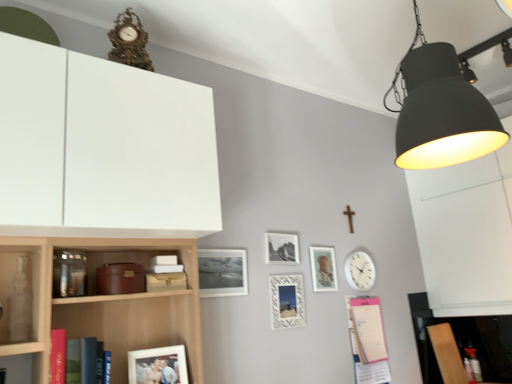
Image resolution: width=512 pixels, height=384 pixels. What are the coordinates of `matte silver picture frame at center-right, which is the first picture frame in back-to-front order` in the screenshot? It's located at (323, 269).

The image size is (512, 384). What do you see at coordinates (158, 365) in the screenshot?
I see `white matte picture frame at lower center, the fifth picture frame viewed from the back` at bounding box center [158, 365].

What is the approximate width of gold ornate clock at upper center, which is the first clock from left to right?

gold ornate clock at upper center, which is the first clock from left to right, is 6.44 inches in width.

Where is `matte black picture frame at upper center, placed as the fourth picture frame when sorted from right to left`? The width and height of the screenshot is (512, 384). matte black picture frame at upper center, placed as the fourth picture frame when sorted from right to left is located at coordinates (222, 272).

Which is in front, point (280, 328) or point (154, 375)?

Point (154, 375)

Is white textured picture frame at center, arranged as the third picture frame when viewed from the front, not close to white matte picture frame at lower center, the fifth picture frame viewed from the back?

white textured picture frame at center, arranged as the third picture frame when viewed from the front, is near white matte picture frame at lower center, the fifth picture frame viewed from the back, not far away.

Identify the location of the 2nd picture frame in front of the white textured picture frame at center, the 4th picture frame positioned from the left. The height and width of the screenshot is (384, 512). coord(158,365).

Based on the photo, looking at the image, does white textured picture frame at center, the 4th picture frame positioned from the left, seem bigger or smaller compared to white matte picture frame at lower center, which is counted as the 5th picture frame, starting from the right?

In the image, white textured picture frame at center, the 4th picture frame positioned from the left, appears to be smaller than white matte picture frame at lower center, which is counted as the 5th picture frame, starting from the right.

Is hardcover book at left, the 2th book from the right, not near metallic silver frame at center, positioned as the fourth picture frame in front-to-back order?

Yes, hardcover book at left, the 2th book from the right, and metallic silver frame at center, positioned as the fourth picture frame in front-to-back order, are located far from each other.

Considering the positions of point (75, 381) and point (294, 253), is point (75, 381) closer or farther from the camera than point (294, 253)?

Point (75, 381).

Based on the photo, is hardcover book at left, the 2th book ordered from the bottom, shorter than metallic silver frame at center, the 3th picture frame when ordered from right to left?

In fact, hardcover book at left, the 2th book ordered from the bottom, may be taller than metallic silver frame at center, the 3th picture frame when ordered from right to left.

From a real-world perspective, starting from the gold ornate clock at upper center, which is the first clock from left to right, which picture frame is the 1st one below it? Please provide its 2D coordinates.

[(281, 248)]

Is metallic silver frame at center, placed as the second picture frame when sorted from back to front, positioned with its back to gold ornate clock at upper center, the second clock from the bottom?

No, metallic silver frame at center, placed as the second picture frame when sorted from back to front, is not facing the opposite direction of gold ornate clock at upper center, the second clock from the bottom.

Based on the photo, does metallic silver frame at center, the 3th picture frame when ordered from right to left, come behind gold ornate clock at upper center, placed as the second clock when sorted from back to front?

Yes, it is behind gold ornate clock at upper center, placed as the second clock when sorted from back to front.

From a real-world perspective, which object stands above the other?

gold ornate clock at upper center, placed as the second clock when sorted from back to front.

Is gold ornate clock at upper center, acting as the 1th clock starting from the front, situated inside matte black lampshade at upper right or outside?

gold ornate clock at upper center, acting as the 1th clock starting from the front, is located beyond the bounds of matte black lampshade at upper right.

Could you tell me if gold ornate clock at upper center, acting as the 1th clock starting from the front, is turned towards matte black lampshade at upper right?

No, gold ornate clock at upper center, acting as the 1th clock starting from the front, does not turn towards matte black lampshade at upper right.

Which is less distant, (133, 46) or (473, 88)?

Point (133, 46) is farther from the camera than point (473, 88).

From the image's perspective, which one is positioned lower, gold ornate clock at upper center, acting as the 1th clock starting from the front, or matte black lampshade at upper right?

From the image's view, matte black lampshade at upper right is below.

Is white plastic clock at upper right, the second clock in the front-to-back sequence, turned away from matte black lampshade at upper right?

That's not correct — white plastic clock at upper right, the second clock in the front-to-back sequence, is not looking away from matte black lampshade at upper right.

Considering the positions of objects white plastic clock at upper right, the 1th clock viewed from the right, and matte black lampshade at upper right in the image provided, who is more to the left, white plastic clock at upper right, the 1th clock viewed from the right, or matte black lampshade at upper right?

From the viewer's perspective, matte black lampshade at upper right appears more on the left side.

Can you tell me how much white plastic clock at upper right, positioned as the first clock in bottom-to-top order, and matte black lampshade at upper right differ in facing direction?

The angular difference between white plastic clock at upper right, positioned as the first clock in bottom-to-top order, and matte black lampshade at upper right is 2.5 degrees.

In order to click on clock lying on the right of matte black lampshade at upper right in this screenshot , I will do `click(360, 271)`.

Does point (170, 371) lie behind point (365, 287)?

No, (170, 371) is closer to viewer.

From a real-world perspective, is white matte picture frame at lower center, the fifth picture frame viewed from the back, above or below white plastic clock at upper right, the second clock in the left-to-right sequence?

In terms of real-world spatial position, white matte picture frame at lower center, the fifth picture frame viewed from the back, is below white plastic clock at upper right, the second clock in the left-to-right sequence.

Who is more distant, white matte picture frame at lower center, the fifth picture frame viewed from the back, or white plastic clock at upper right, the 1th clock viewed from the right?

white plastic clock at upper right, the 1th clock viewed from the right, is behind.

Visually, is white matte picture frame at lower center, which is counted as the 5th picture frame, starting from the right, positioned to the left or to the right of white plastic clock at upper right, positioned as the first clock in bottom-to-top order?

white matte picture frame at lower center, which is counted as the 5th picture frame, starting from the right, is positioned on white plastic clock at upper right, positioned as the first clock in bottom-to-top order,'s left side.

Is metallic silver frame at center, the 3th picture frame when ordered from right to left, completely or partially outside of white textured picture frame at center, placed as the second picture frame when sorted from right to left?

metallic silver frame at center, the 3th picture frame when ordered from right to left, is positioned outside white textured picture frame at center, placed as the second picture frame when sorted from right to left.

Who is more distant, metallic silver frame at center, placed as the second picture frame when sorted from back to front, or white textured picture frame at center, placed as the 3th picture frame when sorted from back to front?

metallic silver frame at center, placed as the second picture frame when sorted from back to front, is further from the camera.

Is metallic silver frame at center, the 3th picture frame in the left-to-right sequence, oriented towards white textured picture frame at center, placed as the second picture frame when sorted from right to left?

No, metallic silver frame at center, the 3th picture frame in the left-to-right sequence, is not turned towards white textured picture frame at center, placed as the second picture frame when sorted from right to left.

Which object is wider, metallic silver frame at center, the 3th picture frame when ordered from right to left, or white textured picture frame at center, placed as the second picture frame when sorted from right to left?

white textured picture frame at center, placed as the second picture frame when sorted from right to left, is wider.

This screenshot has width=512, height=384. Find the location of `the 3rd picture frame to the left of the white textured picture frame at center, placed as the 3th picture frame when sorted from back to front, counting from the anchor's position`. the 3rd picture frame to the left of the white textured picture frame at center, placed as the 3th picture frame when sorted from back to front, counting from the anchor's position is located at coordinates (158, 365).

The width and height of the screenshot is (512, 384). I want to click on the 4th picture frame behind the hardcover book at left, which is counted as the 1th book, starting from the left, so click(281, 248).

Which object lies further to the anchor point metallic silver frame at center, positioned as the fourth picture frame in front-to-back order, white matte picture frame at lower center, positioned as the first picture frame in front-to-back order, or white textured picture frame at center, placed as the second picture frame when sorted from right to left?

white matte picture frame at lower center, positioned as the first picture frame in front-to-back order.

From the image, which object appears to be nearer to pink paper notepad at lower right, which is the 1th book from back to front, hardcover book at left, which is the first book in front-to-back order, or white textured picture frame at center, arranged as the third picture frame when viewed from the front?

Among the two, white textured picture frame at center, arranged as the third picture frame when viewed from the front, is located nearer to pink paper notepad at lower right, which is the 1th book from back to front.

Considering their positions, is gold ornate clock at upper center, which is the first clock from top to bottom, positioned closer to matte black lampshade at upper right than pink paper notepad at lower right, marked as the second book in a top-to-bottom arrangement?

gold ornate clock at upper center, which is the first clock from top to bottom, lies closer to matte black lampshade at upper right than the other object.

Considering their positions, is pink paper notepad at lower right, which is the first book from bottom to top, positioned further to matte black picture frame at upper center, which is counted as the 2th picture frame, starting from the front, than gold ornate clock at upper center, which is the first clock from left to right?

The object further to matte black picture frame at upper center, which is counted as the 2th picture frame, starting from the front, is gold ornate clock at upper center, which is the first clock from left to right.

From the image, which object appears to be nearer to white textured picture frame at center, arranged as the third picture frame when viewed from the front, white matte cabinet at upper left or matte silver picture frame at center-right, the first picture frame from the right?

Based on the image, matte silver picture frame at center-right, the first picture frame from the right, appears to be nearer to white textured picture frame at center, arranged as the third picture frame when viewed from the front.

Based on their spatial positions, is matte black lampshade at upper right or gold ornate clock at upper center, placed as the second clock when sorted from back to front, closer to pink paper notepad at lower right, which is the first book from bottom to top?

Among the two, matte black lampshade at upper right is located nearer to pink paper notepad at lower right, which is the first book from bottom to top.

Based on their spatial positions, is gold ornate clock at upper center, the 2th clock from the right, or matte silver picture frame at center-right, the first picture frame from the right, further from pink paper notepad at lower right, which is the 1th book from back to front?

Based on the image, gold ornate clock at upper center, the 2th clock from the right, appears to be further to pink paper notepad at lower right, which is the 1th book from back to front.

Based on their spatial positions, is white textured picture frame at center, placed as the second picture frame when sorted from right to left, or matte black picture frame at upper center, which is counted as the 2th picture frame, starting from the front, further from matte black lampshade at upper right?

white textured picture frame at center, placed as the second picture frame when sorted from right to left, is positioned further to the anchor matte black lampshade at upper right.

I want to click on picture frame situated between white textured picture frame at center, placed as the second picture frame when sorted from right to left, and white plastic clock at upper right, the second clock in the front-to-back sequence, from left to right, so click(x=323, y=269).

This screenshot has width=512, height=384. I want to click on cabinetry between hardcover book at left, which is the first book in front-to-back order, and matte black lampshade at upper right from left to right, so click(102, 148).

Find the location of a particular element. This screenshot has height=384, width=512. picture frame between metallic silver frame at center, the 3th picture frame when ordered from right to left, and matte silver picture frame at center-right, the first picture frame from the right, in the horizontal direction is located at coordinates (287, 301).

Where is `picture frame situated between white textured picture frame at center, the 4th picture frame positioned from the left, and pink paper notepad at lower right, which is the 1th book from back to front, from left to right`? This screenshot has height=384, width=512. picture frame situated between white textured picture frame at center, the 4th picture frame positioned from the left, and pink paper notepad at lower right, which is the 1th book from back to front, from left to right is located at coordinates (323, 269).